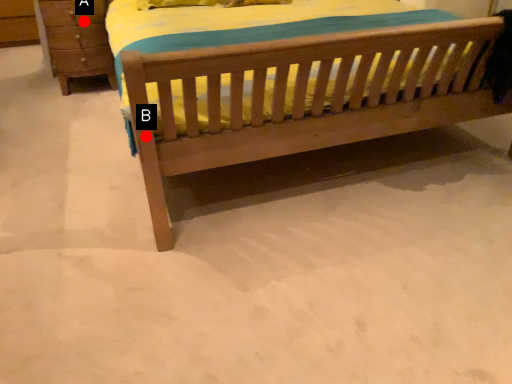
Question: Two points are circled on the image, labeled by A and B beside each circle. Which point is further to the camera?

Choices:
 (A) A is further
 (B) B is further

Answer: (A)